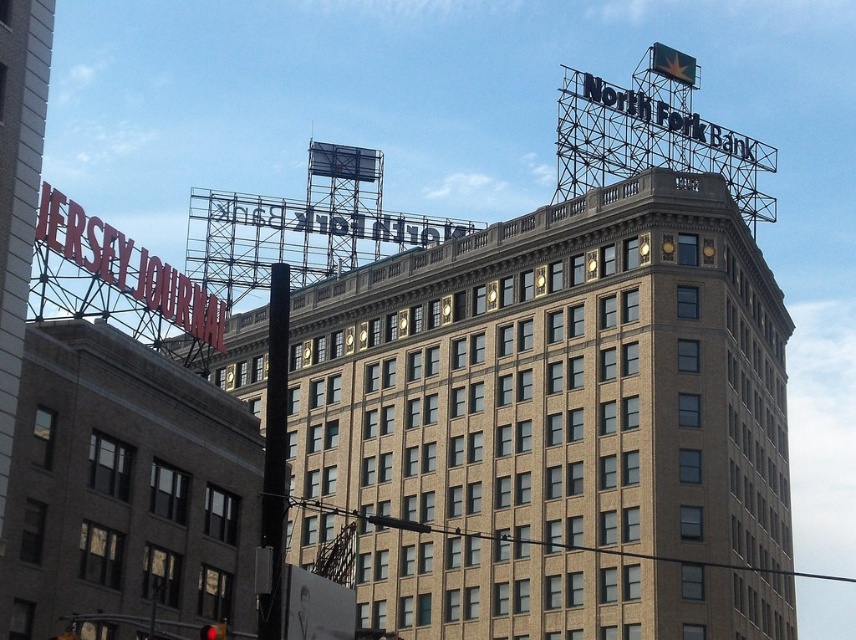
Question: Which of the following is the closest to the observer?

Choices:
 (A) (569, 544)
 (B) (82, 264)

Answer: (B)

Question: Is brown brick building at center smaller than red metal sign at upper left?

Choices:
 (A) yes
 (B) no

Answer: (B)

Question: Is brown brick building at center to the left of red metal sign at upper left from the viewer's perspective?

Choices:
 (A) yes
 (B) no

Answer: (B)

Question: Is brown brick building at center wider than red metal sign at upper left?

Choices:
 (A) yes
 (B) no

Answer: (A)